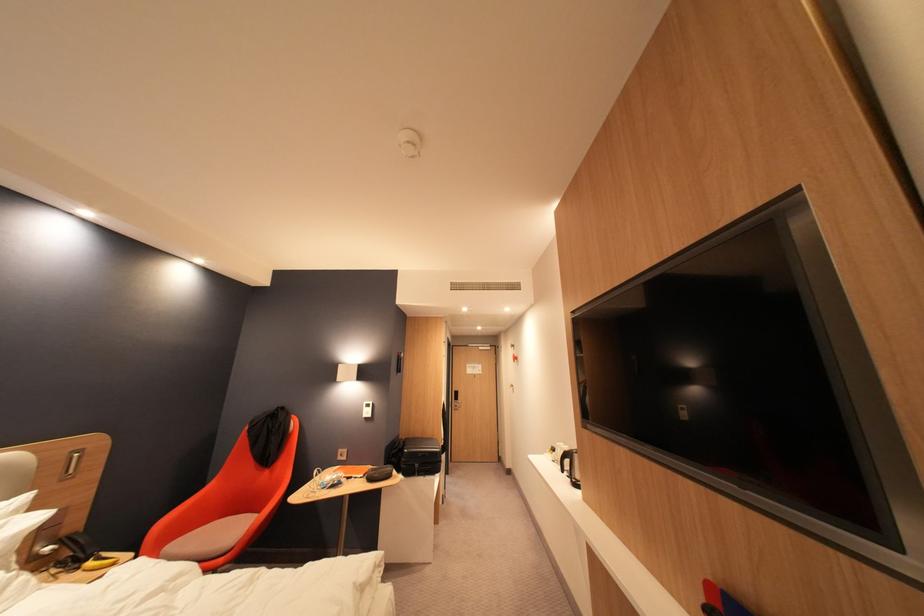
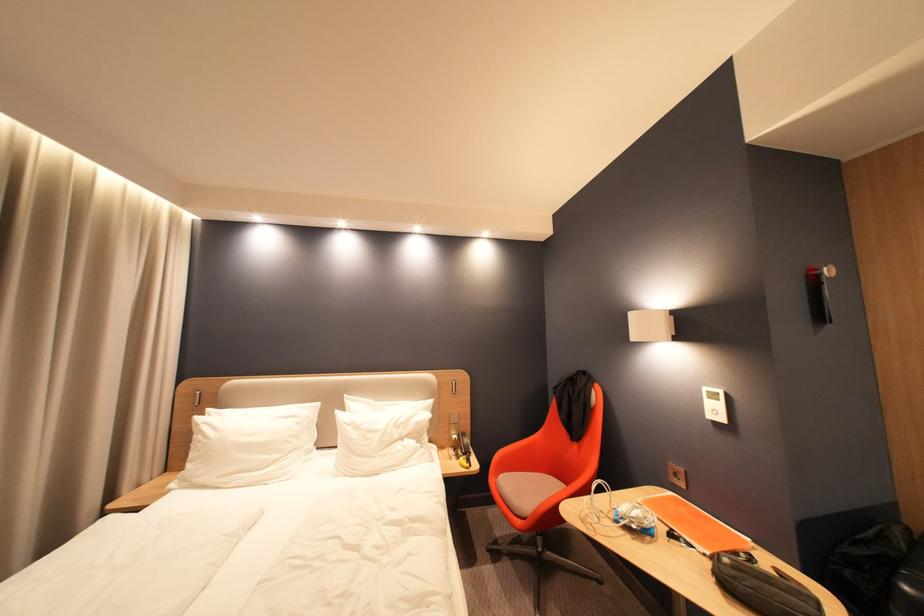
Where in the second image is the point corresponding to point (350, 456) from the first image?

(686, 476)